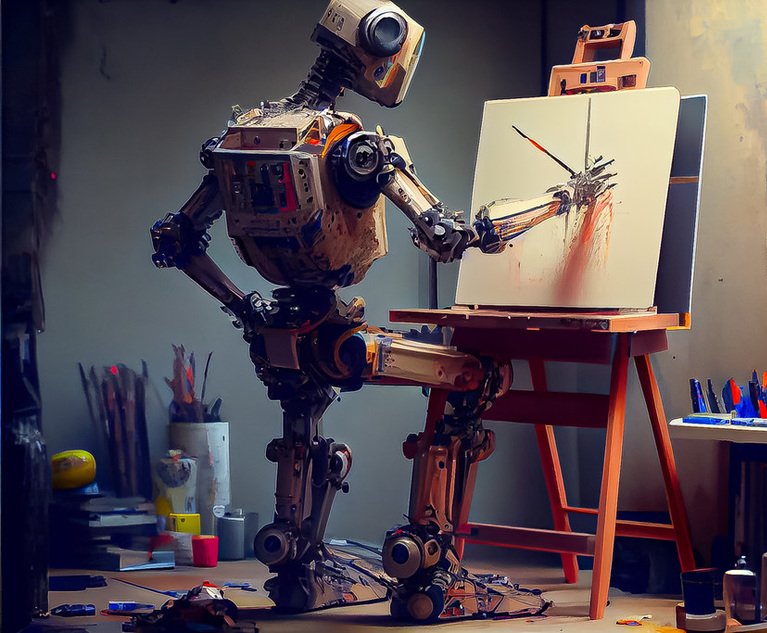
Image resolution: width=767 pixels, height=633 pixels. In order to click on wall in this screenshot , I will do `click(100, 295)`.